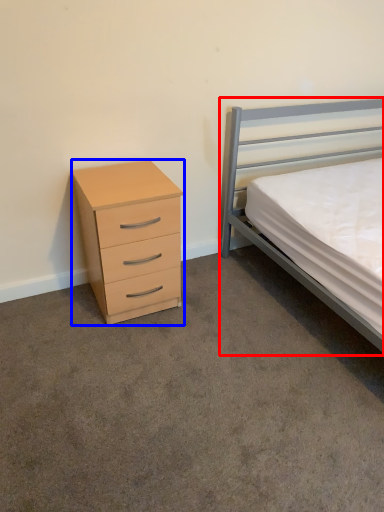
Question: Which object is further to the camera taking this photo, bed (highlighted by a red box) or chest of drawers (highlighted by a blue box)?

Choices:
 (A) bed
 (B) chest of drawers

Answer: (B)